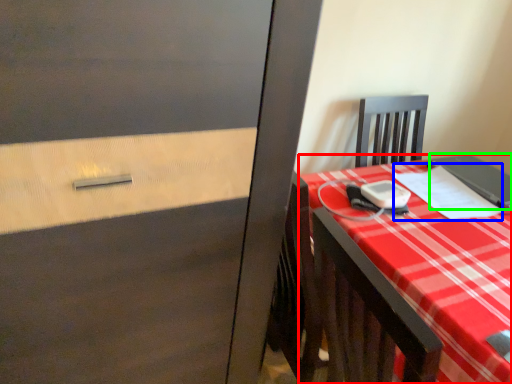
Question: Which is farther away from desk (highlighted by a red box)? notebook (highlighted by a blue box) or notebook (highlighted by a green box)?

Choices:
 (A) notebook
 (B) notebook

Answer: (B)